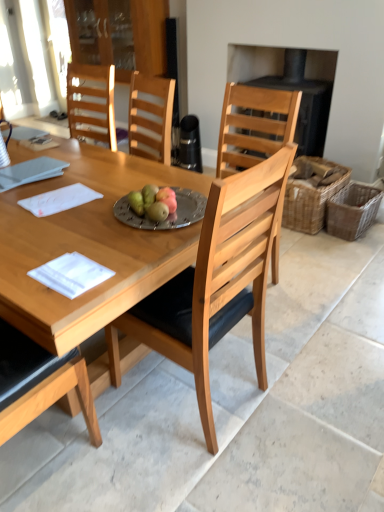
This screenshot has width=384, height=512. I want to click on free space to the back side of white paper at center, the third notepad from the top, so coord(91,244).